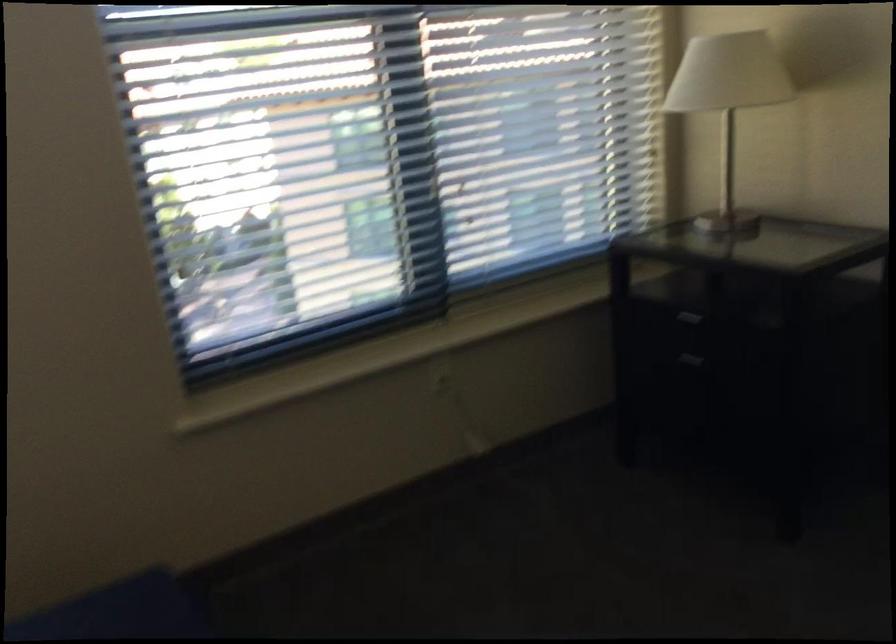
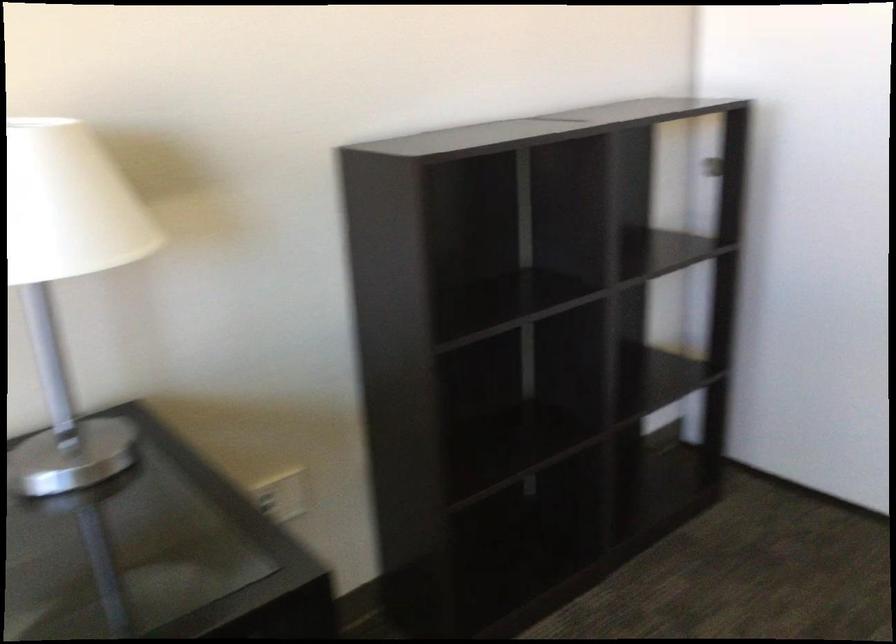
Question: The camera is either moving clockwise (left) or counter-clockwise (right) around the object. The first image is from the beginning of the video and the second image is from the end. Is the camera moving left or right when shooting the video?

Choices:
 (A) Left
 (B) Right

Answer: (A)